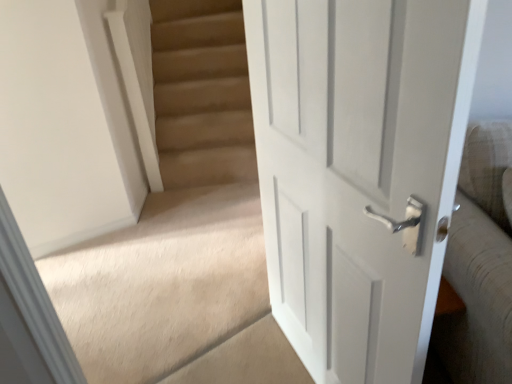
Question: Is white painted wood door at right aimed at carpeted stairs at center?

Choices:
 (A) no
 (B) yes

Answer: (B)

Question: Is white painted wood door at right taller than carpeted stairs at center?

Choices:
 (A) no
 (B) yes

Answer: (A)

Question: Is white painted wood door at right thinner than carpeted stairs at center?

Choices:
 (A) no
 (B) yes

Answer: (B)

Question: Is white painted wood door at right with carpeted stairs at center?

Choices:
 (A) yes
 (B) no

Answer: (B)

Question: Can you confirm if white painted wood door at right is bigger than carpeted stairs at center?

Choices:
 (A) no
 (B) yes

Answer: (A)

Question: Is the depth of white painted wood door at right less than that of carpeted stairs at center?

Choices:
 (A) no
 (B) yes

Answer: (B)

Question: Would you consider carpeted stairs at center to be distant from white painted wood door at right?

Choices:
 (A) yes
 (B) no

Answer: (B)

Question: From a real-world perspective, does carpeted stairs at center sit lower than white painted wood door at right?

Choices:
 (A) yes
 (B) no

Answer: (B)

Question: From a real-world perspective, is carpeted stairs at center positioned over white painted wood door at right based on gravity?

Choices:
 (A) yes
 (B) no

Answer: (A)

Question: Does carpeted stairs at center have a larger size compared to white painted wood door at right?

Choices:
 (A) yes
 (B) no

Answer: (A)

Question: Is carpeted stairs at center taller than white painted wood door at right?

Choices:
 (A) no
 (B) yes

Answer: (B)

Question: Is carpeted stairs at center in front of white painted wood door at right?

Choices:
 (A) yes
 (B) no

Answer: (B)

Question: Is carpeted stairs at center spatially inside white painted wood door at right, or outside of it?

Choices:
 (A) inside
 (B) outside

Answer: (B)